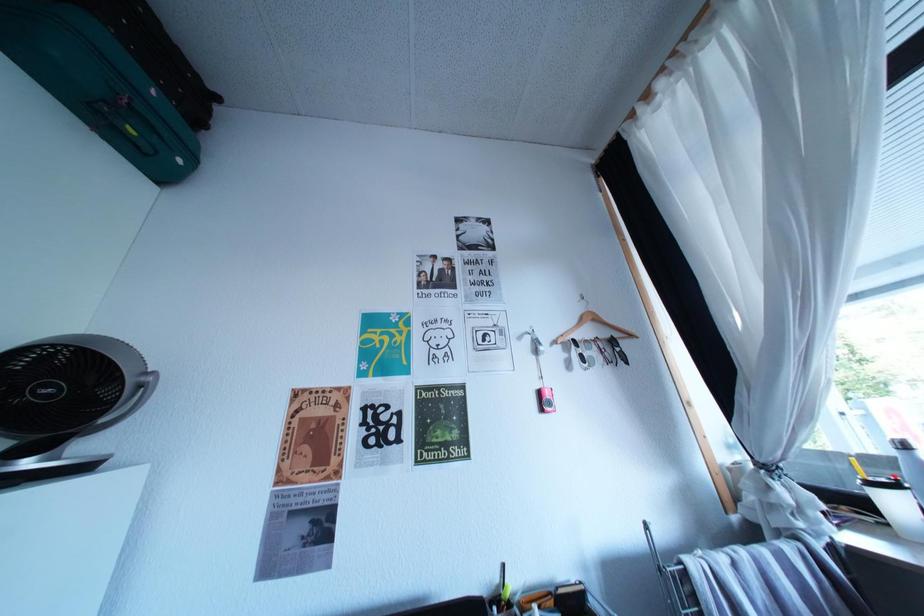
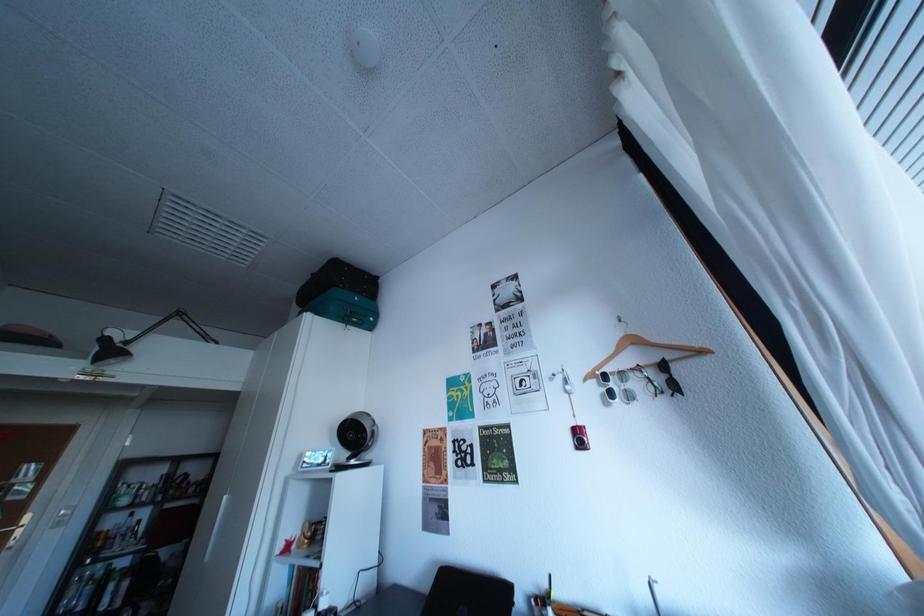
Question: The first image is from the beginning of the video and the second image is from the end. How did the camera likely rotate when shooting the video?

Choices:
 (A) Left
 (B) Right
 (C) Up
 (D) Down

Answer: (A)